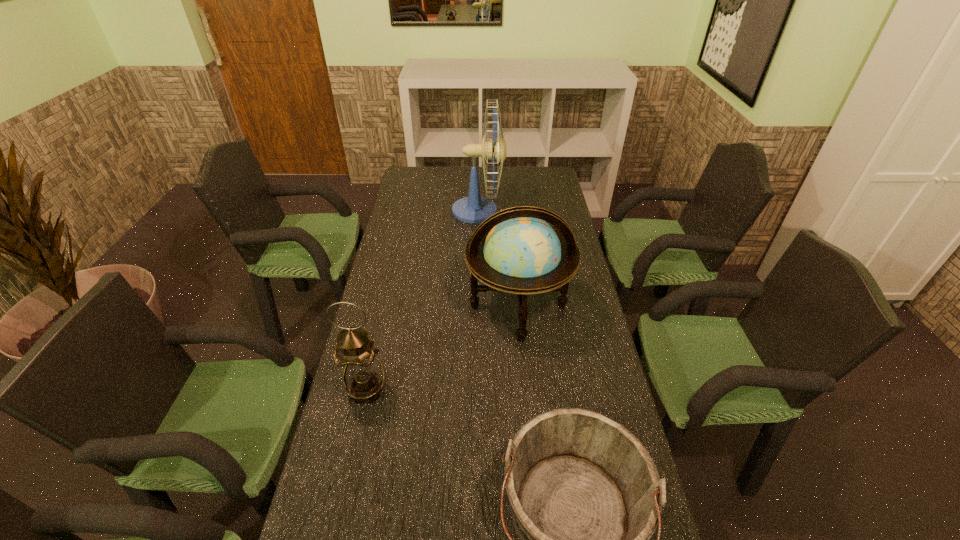
You are a GUI agent. You are given a task and a screenshot of the screen. Output one action in this format:
    pyautogui.click(x=<x>, y=<y>)
    Task: Click on the object that is at the right edge
    Image resolution: width=960 pixels, height=540 pixels.
    Given the screenshot: What is the action you would take?
    pyautogui.click(x=515, y=251)

Where is `free space at the far edge of the desktop`? This screenshot has width=960, height=540. free space at the far edge of the desktop is located at coordinates (449, 191).

Locate an element on the screen. vacant space at the left edge of the desktop is located at coordinates (322, 486).

I want to click on free location at the right edge of the desktop, so click(x=591, y=367).

Locate an element on the screen. This screenshot has height=540, width=960. free point at the far left corner is located at coordinates (429, 186).

You are a GUI agent. You are given a task and a screenshot of the screen. Output one action in this format:
    pyautogui.click(x=<x>, y=<y>)
    Task: Click on the vacant region at the far right corner
    
    Given the screenshot: What is the action you would take?
    pyautogui.click(x=549, y=174)

Image resolution: width=960 pixels, height=540 pixels. I want to click on free space between the globe and the oil lamp, so click(x=443, y=348).

Where is `vacant space that's between the leftmost object and the third nearest object`? The image size is (960, 540). vacant space that's between the leftmost object and the third nearest object is located at coordinates (443, 348).

Identify the location of vacant space that's between the third farthest object and the third nearest object. (443, 348).

Where is `free space between the fan and the leftmost object`? This screenshot has width=960, height=540. free space between the fan and the leftmost object is located at coordinates (422, 300).